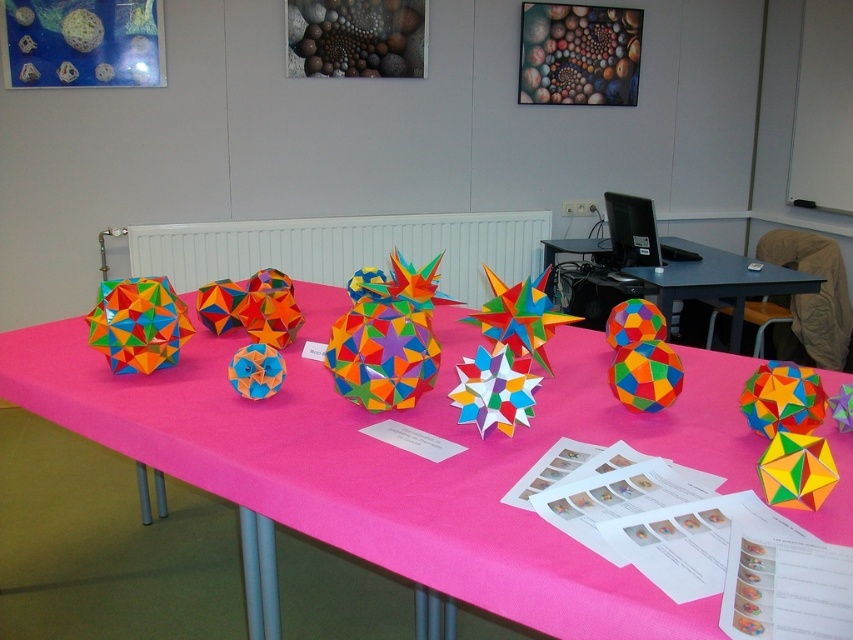
Question: Is multicolored paper at center below multicolored paper star at center?

Choices:
 (A) yes
 (B) no

Answer: (A)

Question: Can you confirm if multicolored paper at center is thinner than multicolored paper star at center?

Choices:
 (A) yes
 (B) no

Answer: (B)

Question: Which point is closer to the camera?

Choices:
 (A) multicolored paper star at center
 (B) multicolored paper at center

Answer: (B)

Question: Which point appears closest to the camera in this image?

Choices:
 (A) (515, 595)
 (B) (675, 275)

Answer: (A)

Question: Observing the image, what is the correct spatial positioning of multicolored paper at center in reference to multicolored paper star at center?

Choices:
 (A) right
 (B) left

Answer: (B)